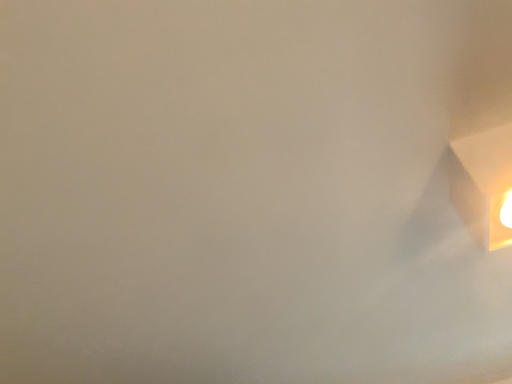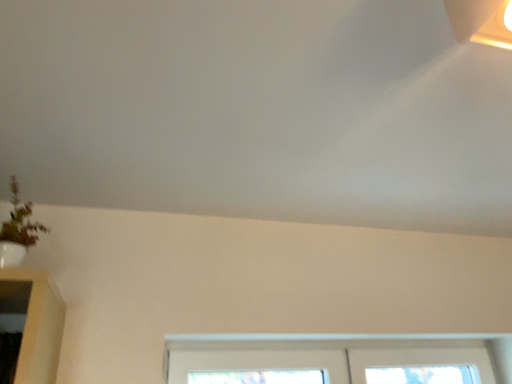
Question: How did the camera likely rotate when shooting the video?

Choices:
 (A) rotated downward
 (B) rotated upward

Answer: (A)